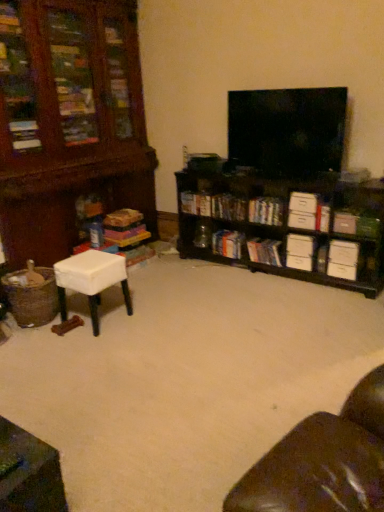
The image size is (384, 512). What are the coordinates of `vacant point above hardcover books at center, which is the fourth book in right-to-left order (from a real-world perspective)` in the screenshot? It's located at (264, 243).